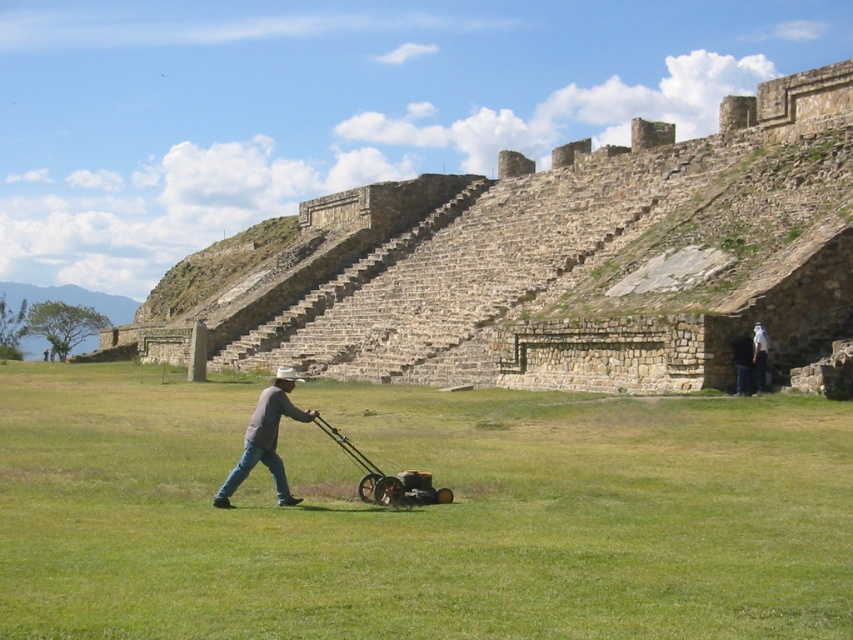
Can you confirm if stone amphitheater at center is positioned below dark gray fabric shirt at lower right?

Incorrect, stone amphitheater at center is not positioned below dark gray fabric shirt at lower right.

Identify the location of stone amphitheater at center. The height and width of the screenshot is (640, 853). (552, 262).

Is point (706, 193) closer to camera compared to point (746, 340)?

No, (706, 193) is behind (746, 340).

Find the location of a particular element. This screenshot has height=640, width=853. stone amphitheater at center is located at coordinates (552, 262).

In the scene shown: Is dark gray fabric shirt at lower right wider than white cotton shirt at center?

Correct, the width of dark gray fabric shirt at lower right exceeds that of white cotton shirt at center.

Which is below, dark gray fabric shirt at lower right or white cotton shirt at center?

dark gray fabric shirt at lower right is below.

The image size is (853, 640). What do you see at coordinates (741, 362) in the screenshot?
I see `dark gray fabric shirt at lower right` at bounding box center [741, 362].

Where is `dark gray fabric shirt at lower right`? The image size is (853, 640). dark gray fabric shirt at lower right is located at coordinates (741, 362).

Between green grass at center and dark gray fabric shirt at lower right, which one is positioned higher?

dark gray fabric shirt at lower right

Who is more forward, (427, 536) or (741, 384)?

Point (427, 536)

Identify the location of green grass at center. (419, 513).